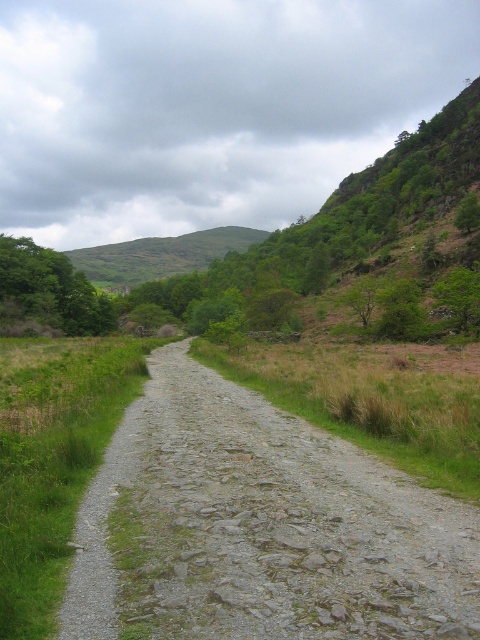
You are standing at the starting point of the dirt path in the rural landscape. You see two points marked on the path ahead of you. The first point is located at coordinates point (439, 561) and the second point is at point (194, 237). Which of these two points is closer to your current position?

Point (439, 561) is closer to the camera than point (194, 237), so the first point is closer to your current position.

You are a hiker carrying a 12 foot long ladder. You come across the gray gravel trail at center. Can you carry the ladder horizontally along the trail without bending it?

The gray gravel trail at center has a width of 13.54 feet. Since the ladder is 12 feet long, it can be carried horizontally as the trail is wider than the ladder.